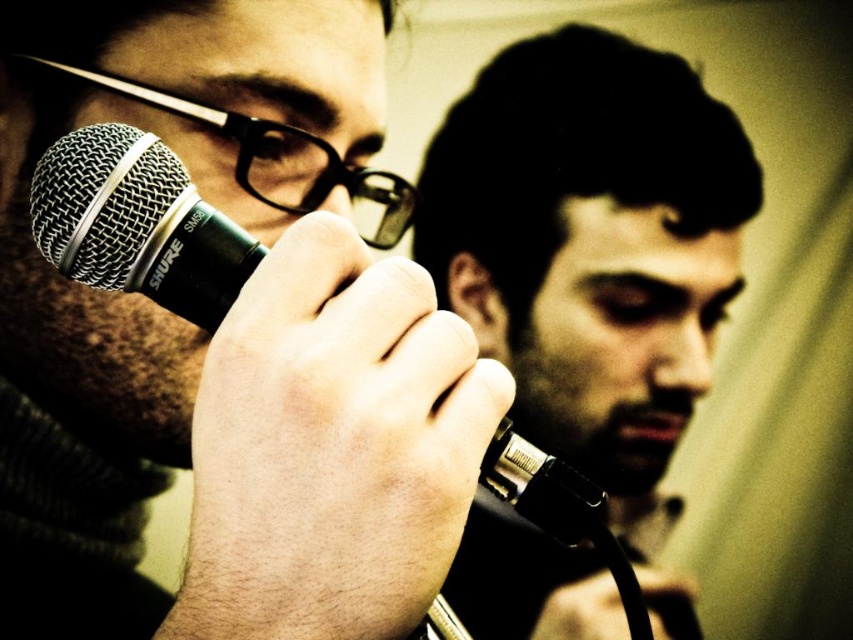
Question: Can you confirm if black metallic microphone at center is smaller than black plastic glasses at upper left?

Choices:
 (A) no
 (B) yes

Answer: (B)

Question: Which object is closer to the camera taking this photo?

Choices:
 (A) black plastic glasses at upper left
 (B) black metallic microphone at center

Answer: (B)

Question: Is black metallic microphone at center bigger than black plastic glasses at upper left?

Choices:
 (A) yes
 (B) no

Answer: (B)

Question: Which of the following is the farthest from the observer?

Choices:
 (A) (158, 90)
 (B) (553, 474)

Answer: (A)

Question: Which object is the closest to the matte black microphone at center?

Choices:
 (A) black metallic microphone at center
 (B) black plastic glasses at upper left

Answer: (B)

Question: Can you confirm if matte black microphone at center is positioned to the left of black plastic glasses at upper left?

Choices:
 (A) no
 (B) yes

Answer: (A)